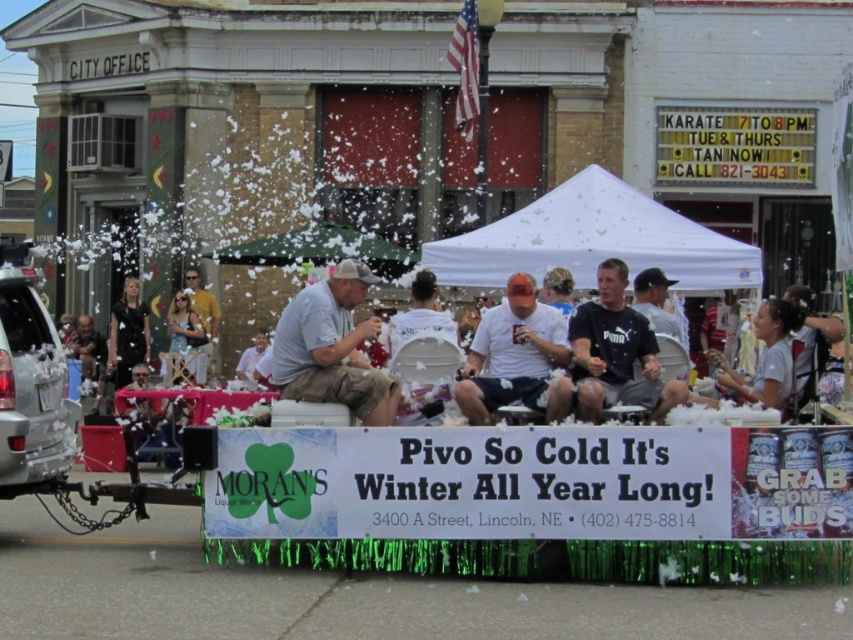
You are a photographer at the event and need to ensure both the gray cotton shirt at center and the gray fabric cap at center are clearly visible in your photo. Considering their sizes, which object should you focus on to capture both without cropping either?

The gray cotton shirt at center is larger in size than the gray fabric cap at center, so you should focus on the gray cotton shirt at center first to ensure it fits within the frame, then adjust to include the smaller gray fabric cap at center as well.